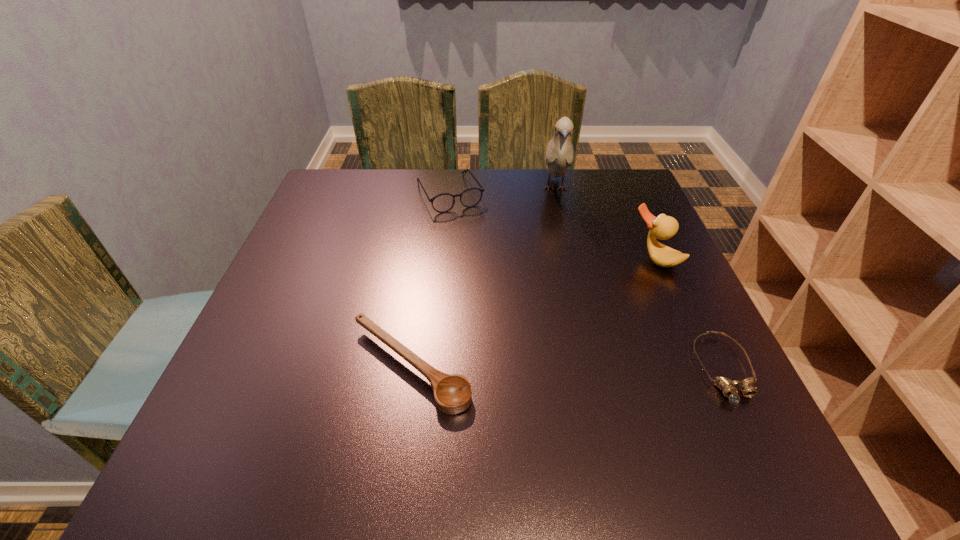
Where is `free space between the fourth tallest object and the third farthest object`? The height and width of the screenshot is (540, 960). free space between the fourth tallest object and the third farthest object is located at coordinates (532, 313).

In order to click on free spot between the duck and the bird in this screenshot , I will do pyautogui.click(x=604, y=224).

Identify the location of vacant area that lies between the third nearest object and the goggles. The height and width of the screenshot is (540, 960). (688, 314).

The image size is (960, 540). I want to click on free space between the third object from left to right and the fourth tallest object, so click(483, 278).

Where is `free point between the wooden spoon and the duck`? This screenshot has height=540, width=960. free point between the wooden spoon and the duck is located at coordinates (532, 313).

This screenshot has width=960, height=540. Identify the location of unoccupied position between the third shortest object and the shortest object. (587, 282).

At what (x,y) coordinates should I click in order to perform the action: click on free space between the duck and the second shortest object. Please return your answer as a coordinate pair (x, y). Image resolution: width=960 pixels, height=540 pixels. Looking at the image, I should click on (532, 313).

Where is `free area in between the third tallest object and the third farthest object`? free area in between the third tallest object and the third farthest object is located at coordinates (551, 226).

You are a GUI agent. You are given a task and a screenshot of the screen. Output one action in this format:
    pyautogui.click(x=<x>, y=<y>)
    Task: Click on the vacant space that's between the wooden spoon and the duck
    This screenshot has height=540, width=960.
    Given the screenshot: What is the action you would take?
    pyautogui.click(x=532, y=313)

You are a GUI agent. You are given a task and a screenshot of the screen. Output one action in this format:
    pyautogui.click(x=<x>, y=<y>)
    Task: Click on the fourth closest object to the third object from left to right
    This screenshot has height=540, width=960.
    Given the screenshot: What is the action you would take?
    pyautogui.click(x=728, y=387)